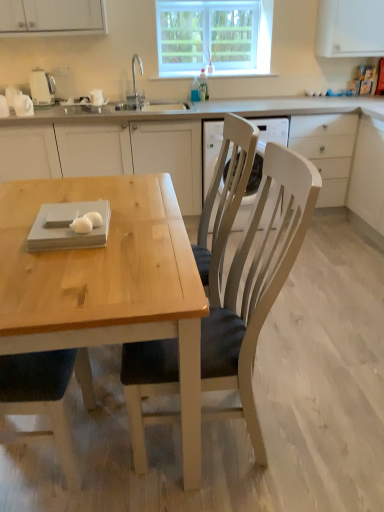
In order to face white glossy electric kettle at upper left, should I rotate leftwards or rightwards?

You should rotate left by 19.444 degrees.

What do you see at coordinates (214, 37) in the screenshot?
I see `clear glass window at upper center` at bounding box center [214, 37].

What do you see at coordinates (94, 218) in the screenshot? Image resolution: width=384 pixels, height=512 pixels. I see `white glossy egg at table, which is counted as the 1th food, starting from the back` at bounding box center [94, 218].

What do you see at coordinates (257, 286) in the screenshot?
I see `wooden chair at center` at bounding box center [257, 286].

Where is `white glossy electric kettle at upper left`? The width and height of the screenshot is (384, 512). white glossy electric kettle at upper left is located at coordinates (42, 87).

From the image's perspective, which one is positioned higher, white glossy egg at table, which is counted as the 1th food, starting from the back, or white glossy egg at table, which is counted as the 2th food, starting from the back?

white glossy egg at table, which is counted as the 1th food, starting from the back.

Is white glossy egg at table, the second food in the front-to-back sequence, far away from white glossy egg at table, which is counted as the 2th food, starting from the back?

white glossy egg at table, the second food in the front-to-back sequence, is actually quite close to white glossy egg at table, which is counted as the 2th food, starting from the back.

Can you tell me how much white glossy egg at table, which is counted as the 1th food, starting from the back, and white glossy egg at table, which is counted as the 2th food, starting from the back, differ in facing direction?

0.0148 degrees.

Is natural wood table at center not near wooden chair at center?

Yes, natural wood table at center and wooden chair at center are quite far apart.

From the image's perspective, does natural wood table at center appear higher than wooden chair at center?

Indeed, from the image's perspective, natural wood table at center is shown above wooden chair at center.

Considering the points (179, 153) and (308, 220), which point is in front, point (179, 153) or point (308, 220)?

The point (308, 220) is closer to the camera.

Is the position of natural wood table at center more distant than that of wooden chair at center?

Yes.

Consider the image. Is white glossy egg at table, which is counted as the 1th food, starting from the back, next to white matte drawer at center right?

They are not placed beside each other.

Which of these two, white glossy egg at table, the second food in the front-to-back sequence, or white matte drawer at center right, is thinner?

white glossy egg at table, the second food in the front-to-back sequence, is thinner.

Where is `the 1st food positioned below the white matte drawer at center right (from the image's perspective)`? The width and height of the screenshot is (384, 512). the 1st food positioned below the white matte drawer at center right (from the image's perspective) is located at coordinates (94, 218).

Could you tell me if white glossy egg at table, which is counted as the 2th food, starting from the back, is turned towards clear glass window at upper center?

No.

In the scene shown: Considering the sizes of objects white glossy egg at table, which is counted as the 2th food, starting from the back, and clear glass window at upper center in the image provided, who is bigger, white glossy egg at table, which is counted as the 2th food, starting from the back, or clear glass window at upper center?

clear glass window at upper center is bigger.

Would you say white glossy egg at table, which is counted as the 2th food, starting from the back, is to the left or to the right of clear glass window at upper center in the picture?

From the image, it's evident that white glossy egg at table, which is counted as the 2th food, starting from the back, is to the left of clear glass window at upper center.

How far apart are white glossy egg at table, which is counted as the 1th food, starting from the back, and wooden chair at center?

A distance of 25.32 inches exists between white glossy egg at table, which is counted as the 1th food, starting from the back, and wooden chair at center.

Image resolution: width=384 pixels, height=512 pixels. What are the coordinates of `chair that appears on the right of white glossy egg at table, which is counted as the 1th food, starting from the back` in the screenshot? It's located at (257, 286).

Could you tell me if white glossy egg at table, which is counted as the 1th food, starting from the back, is facing wooden chair at center?

No, white glossy egg at table, which is counted as the 1th food, starting from the back, is not oriented towards wooden chair at center.

In terms of width, does white glossy egg at table, which is counted as the 1th food, starting from the back, look wider or thinner when compared to wooden chair at center?

white glossy egg at table, which is counted as the 1th food, starting from the back, is thinner than wooden chair at center.

Consider the image. Is white glossy egg at table, which is counted as the 1th food, starting from the back, bigger or smaller than white glossy electric kettle at upper left?

→ white glossy egg at table, which is counted as the 1th food, starting from the back, is smaller than white glossy electric kettle at upper left.

Between white glossy egg at table, the second food in the front-to-back sequence, and white glossy electric kettle at upper left, which one is positioned in front?

white glossy egg at table, the second food in the front-to-back sequence, is closer to the camera.

Is white glossy egg at table, the second food in the front-to-back sequence, not near white glossy electric kettle at upper left?

That's right, there is a large distance between white glossy egg at table, the second food in the front-to-back sequence, and white glossy electric kettle at upper left.

Considering the relative sizes of natural wood table at center and white glossy egg at table, which is counted as the 2th food, starting from the back, in the image provided, is natural wood table at center shorter than white glossy egg at table, which is counted as the 2th food, starting from the back,?

No.

From the image's perspective, which is below, natural wood table at center or white glossy egg at table, which appears as the 1th food when viewed from the front?

white glossy egg at table, which appears as the 1th food when viewed from the front.

There is a natural wood table at center. Where is `the 2nd food below it (from the image's perspective)`? The height and width of the screenshot is (512, 384). the 2nd food below it (from the image's perspective) is located at coordinates (86, 222).

Considering the sizes of objects natural wood table at center and white glossy egg at table, which appears as the 1th food when viewed from the front, in the image provided, who is bigger, natural wood table at center or white glossy egg at table, which appears as the 1th food when viewed from the front,?

Bigger between the two is natural wood table at center.

Where is `food above the white glossy egg at table, which is counted as the 2th food, starting from the back (from the image's perspective)`? food above the white glossy egg at table, which is counted as the 2th food, starting from the back (from the image's perspective) is located at coordinates (94, 218).

Find the location of a particular element. This screenshot has height=512, width=384. chair positioned vertically above the natural wood table at center (from a real-world perspective) is located at coordinates (257, 286).

Considering their positions, is white matte drawer at center right positioned further to wooden chair at center than natural wood table at center?

white matte drawer at center right.

Which object lies nearer to the anchor point white glossy egg at table, which appears as the 1th food when viewed from the front, white glossy electric kettle at upper left or wooden chair at center?

wooden chair at center is positioned closer to the anchor white glossy egg at table, which appears as the 1th food when viewed from the front.

Based on their spatial positions, is white matte drawer at center right or white glossy egg at table, the second food in the front-to-back sequence, closer to natural wood table at center?

white matte drawer at center right is positioned closer to the anchor natural wood table at center.

Considering their positions, is wooden chair at center positioned further to white glossy egg at table, which is counted as the 2th food, starting from the back, than white matte drawer at center right?

The object further to white glossy egg at table, which is counted as the 2th food, starting from the back, is white matte drawer at center right.

Consider the image. When comparing their distances from white glossy egg at table, which is counted as the 1th food, starting from the back, does white glossy egg at table, which appears as the 1th food when viewed from the front, or natural wood table at center seem closer?

white glossy egg at table, which appears as the 1th food when viewed from the front, is positioned closer to the anchor white glossy egg at table, which is counted as the 1th food, starting from the back.

Estimate the real-world distances between objects in this image. Which object is closer to white matte drawer at center right, white glossy egg at table, which is counted as the 2th food, starting from the back, or natural wood table at center?

Among the two, natural wood table at center is located nearer to white matte drawer at center right.

When comparing their distances from white glossy electric kettle at upper left, does wooden chair at center or white glossy egg at table, which appears as the 1th food when viewed from the front, seem further?

wooden chair at center.

Considering their positions, is natural wood table at center positioned closer to white matte drawer at center right than white glossy electric kettle at upper left?

Among the two, natural wood table at center is located nearer to white matte drawer at center right.

Where is `food between white glossy egg at table, which appears as the 1th food when viewed from the front, and natural wood table at center, along the z-axis`? food between white glossy egg at table, which appears as the 1th food when viewed from the front, and natural wood table at center, along the z-axis is located at coordinates (94, 218).

I want to click on window between white glossy electric kettle at upper left and white matte drawer at center right, so click(x=214, y=37).

Find the location of a particular element. This screenshot has width=384, height=512. cabinetry located between white glossy egg at table, which appears as the 1th food when viewed from the front, and white glossy electric kettle at upper left in the depth direction is located at coordinates (109, 153).

Locate an element on the screen. food between wooden chair at center and white glossy egg at table, the second food in the front-to-back sequence, in the front-back direction is located at coordinates (86, 222).